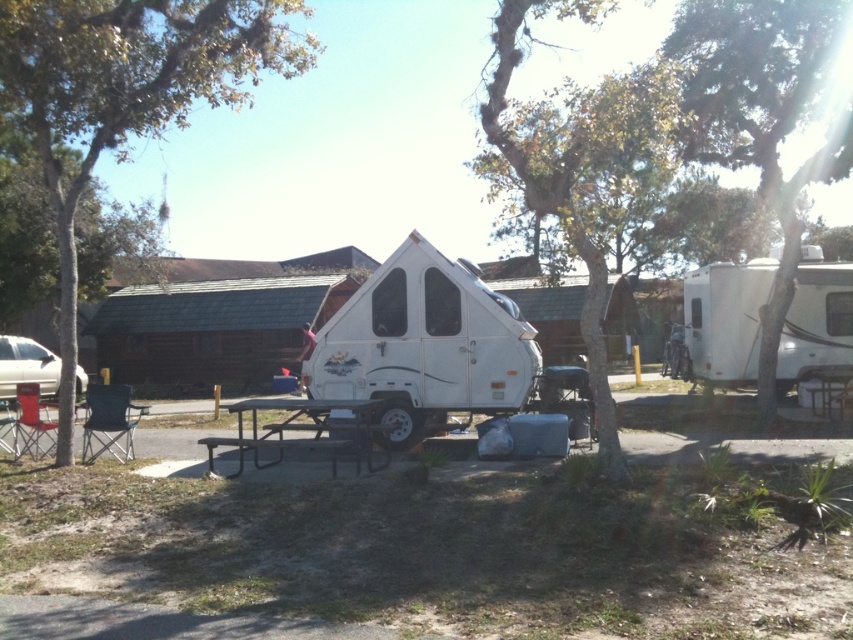
Question: Can you confirm if white glossy camper at right is positioned below metallic silver picnic table at center?

Choices:
 (A) yes
 (B) no

Answer: (B)

Question: Which object appears farthest from the camera in this image?

Choices:
 (A) white matte camper at center
 (B) green leafy tree at right

Answer: (B)

Question: Based on their relative distances, which object is farther from the metallic silver car at left?

Choices:
 (A) green leafy tree at left
 (B) metallic silver picnic table at center
 (C) white matte camper at center

Answer: (C)

Question: Is white glossy camper at right to the left of metallic silver picnic table at center from the viewer's perspective?

Choices:
 (A) yes
 (B) no

Answer: (B)

Question: Based on their relative distances, which object is nearer to the white matte camper at center?

Choices:
 (A) metallic silver picnic table at center
 (B) green leafy tree at left

Answer: (A)

Question: Is green leafy tree at right bigger than metallic silver picnic table at center?

Choices:
 (A) no
 (B) yes

Answer: (B)